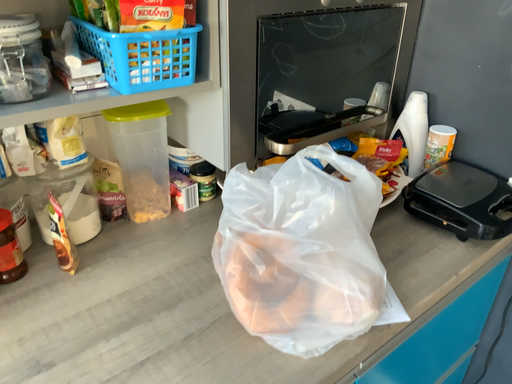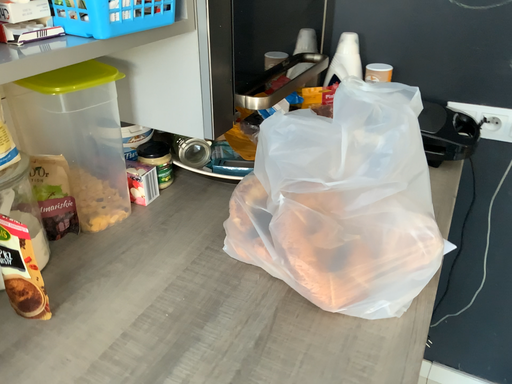
Question: Which way did the camera rotate in the video?

Choices:
 (A) rotated right
 (B) rotated left

Answer: (A)